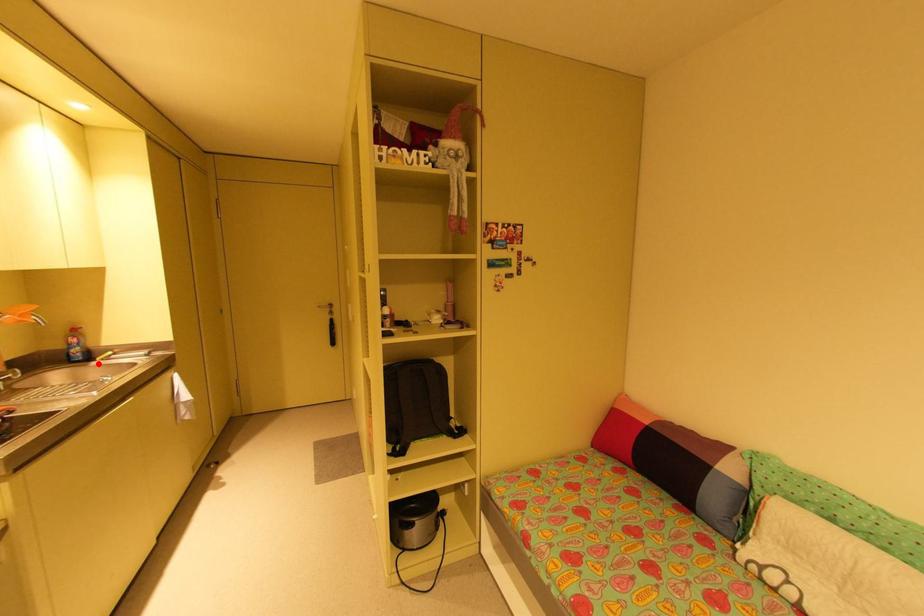
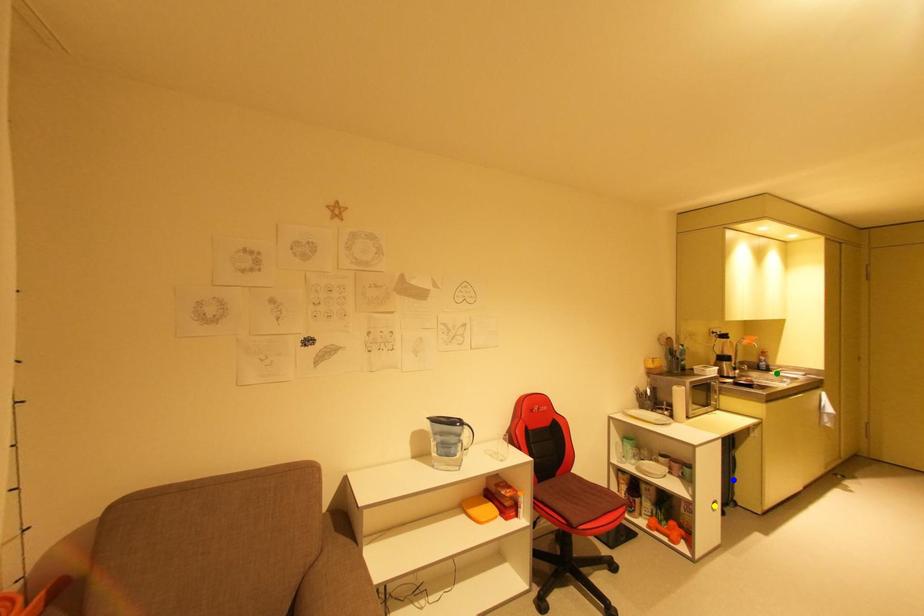
Question: I am providing you with two images of the same scene from different viewpoints. A red point is marked on the first image. You are given multiple points on the second image. Which spot in image 2 lines up with the point in image 1?

Choices:
 (A) yellow point
 (B) blue point
 (C) green point

Answer: (C)